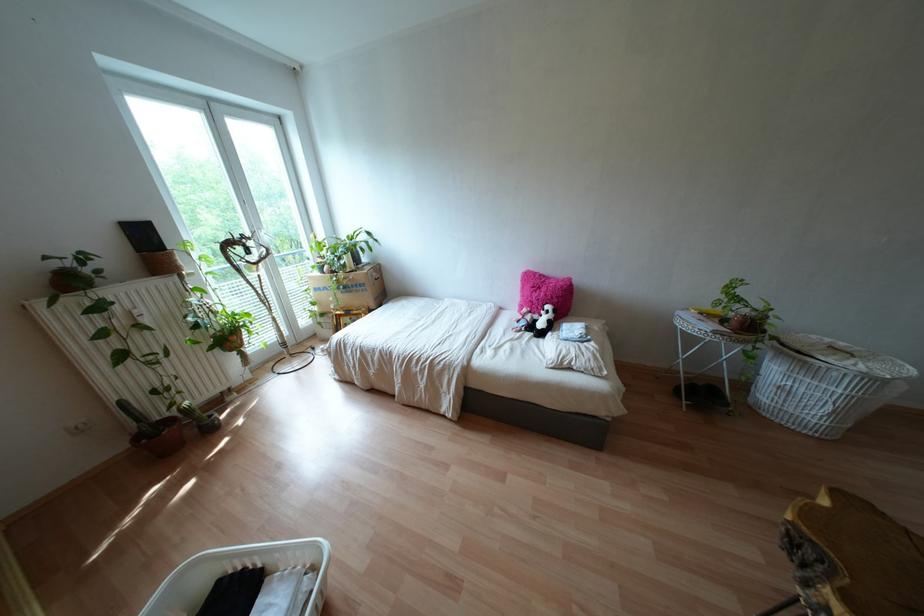
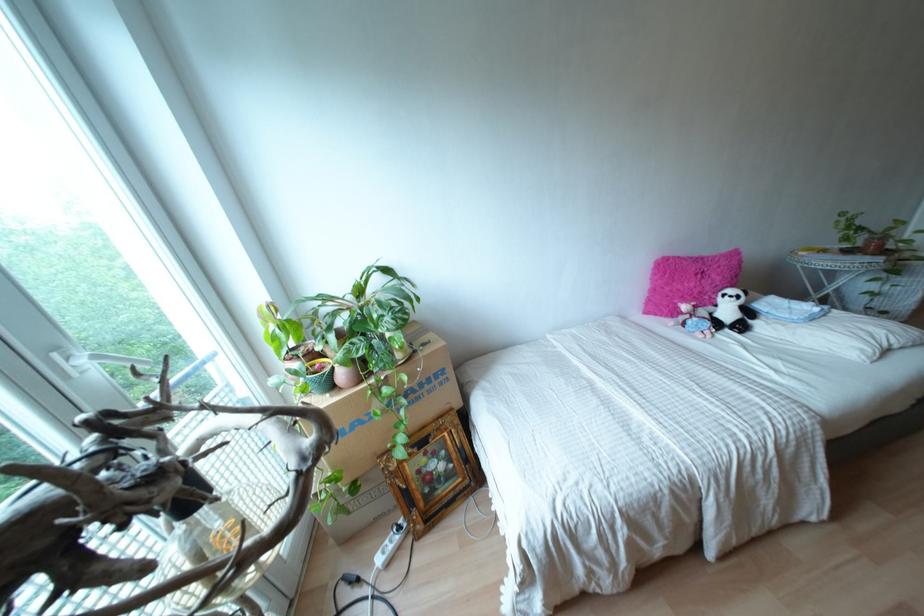
Where in the second image is the point corresponding to pixel 355 285 from the first image?

(428, 379)